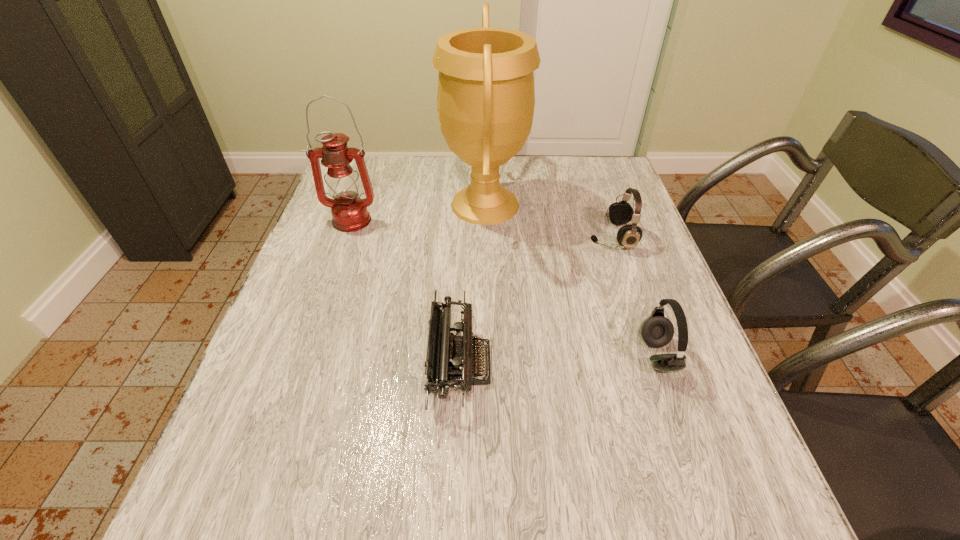
The image size is (960, 540). Identify the location of free space at the near edge of the desktop. [x=405, y=529].

Locate an element on the screen. free space at the left edge of the desktop is located at coordinates (290, 394).

Where is `free space at the right edge of the desktop`? The height and width of the screenshot is (540, 960). free space at the right edge of the desktop is located at coordinates (630, 299).

You are a GUI agent. You are given a task and a screenshot of the screen. Output one action in this format:
    pyautogui.click(x=<x>, y=<y>)
    Task: Click on the vacant region at the far right corner of the desktop
    
    Given the screenshot: What is the action you would take?
    pyautogui.click(x=583, y=165)

This screenshot has height=540, width=960. In the image, there is a desktop. In order to click on vacant space at the near right corner in this screenshot , I will do `click(672, 495)`.

Locate an element on the screen. The height and width of the screenshot is (540, 960). free area in between the typewriter and the farther headset is located at coordinates (536, 301).

At what (x,y) coordinates should I click in order to perform the action: click on free space between the oil lamp and the trophy. Please return your answer as a coordinate pair (x, y). Looking at the image, I should click on (418, 213).

You are a GUI agent. You are given a task and a screenshot of the screen. Output one action in this format:
    pyautogui.click(x=<x>, y=<y>)
    Task: Click on the empty space between the nearer headset and the tallest object
    
    Given the screenshot: What is the action you would take?
    pyautogui.click(x=571, y=280)

Where is `vacant space in between the trophy and the second tallest object`? Image resolution: width=960 pixels, height=540 pixels. vacant space in between the trophy and the second tallest object is located at coordinates (418, 213).

Locate an element on the screen. Image resolution: width=960 pixels, height=540 pixels. vacant area that lies between the farther headset and the nearer headset is located at coordinates (635, 296).